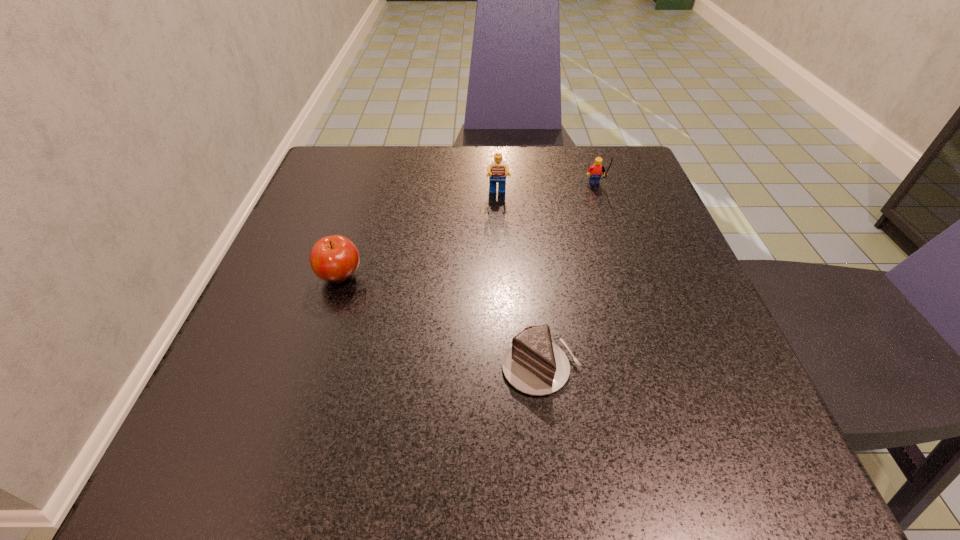
At what (x,y) coordinates should I click in order to perform the action: click on object that is the closest one to the apple. Please return your answer as a coordinate pair (x, y). This screenshot has width=960, height=540. Looking at the image, I should click on (533, 364).

Identify the location of free region that satisfies the following two spatial constraints: 1. on the face of the left Lego; 2. on the right side of the nearest object. The width and height of the screenshot is (960, 540). (506, 367).

Locate an element on the screen. This screenshot has width=960, height=540. vacant region that satisfies the following two spatial constraints: 1. on the face of the nearest object; 2. on the right side of the left Lego is located at coordinates (506, 367).